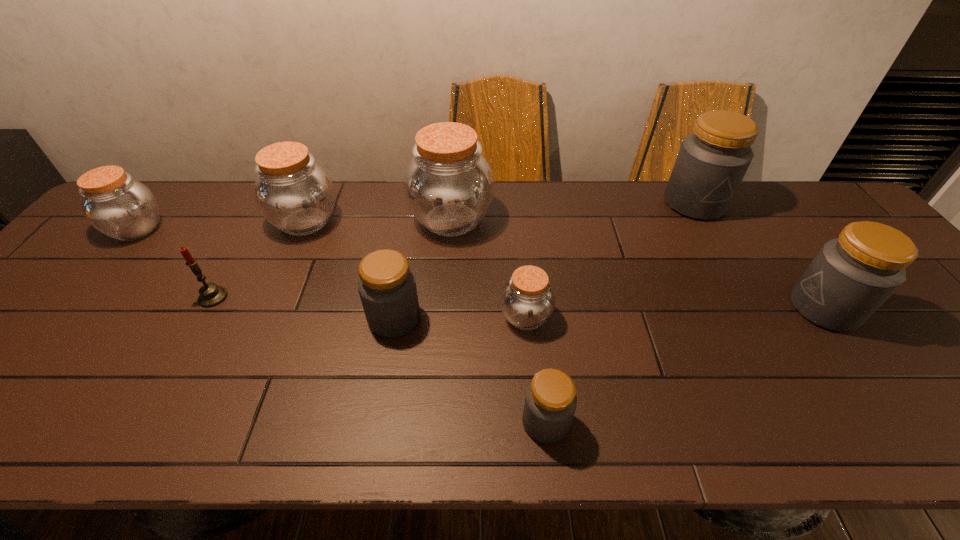
Identify the location of vacant area at the far edge of the desktop. Image resolution: width=960 pixels, height=540 pixels. (252, 207).

In the image, there is a desktop. Where is `vacant space at the near edge`? This screenshot has height=540, width=960. vacant space at the near edge is located at coordinates (394, 410).

At what (x,y) coordinates should I click in order to perform the action: click on blank space at the far left corner of the desktop. Please return your answer as a coordinate pair (x, y). This screenshot has height=540, width=960. Looking at the image, I should click on point(167,207).

You are a GUI agent. You are given a task and a screenshot of the screen. Output one action in this format:
    pyautogui.click(x=<x>, y=<y>)
    Task: Click on the vacant space at the far right corner of the desktop
    
    Given the screenshot: What is the action you would take?
    pyautogui.click(x=845, y=219)

Where is `vacant space that's between the second biggest gray jar and the second brown jar from left to right`? Image resolution: width=960 pixels, height=540 pixels. vacant space that's between the second biggest gray jar and the second brown jar from left to right is located at coordinates (564, 265).

What are the coordinates of `vacant space that is in between the nearest brown jar and the farthest gray jar` in the screenshot? It's located at (611, 260).

You are a GUI agent. You are given a task and a screenshot of the screen. Output one action in this format:
    pyautogui.click(x=<x>, y=<y>)
    Task: Click on the vacant space that is in between the rightmost brown jar and the leftmost object
    
    Given the screenshot: What is the action you would take?
    pyautogui.click(x=331, y=273)

The height and width of the screenshot is (540, 960). In order to click on blank region between the leftmost brown jar and the nearest object in this screenshot , I will do `click(342, 326)`.

In order to click on vacant region between the nearest gray jar and the farthest gray jar in this screenshot , I will do `click(620, 313)`.

Where is `vacant area that lies between the rightmost brown jar and the second smallest brown jar`? Image resolution: width=960 pixels, height=540 pixels. vacant area that lies between the rightmost brown jar and the second smallest brown jar is located at coordinates (331, 273).